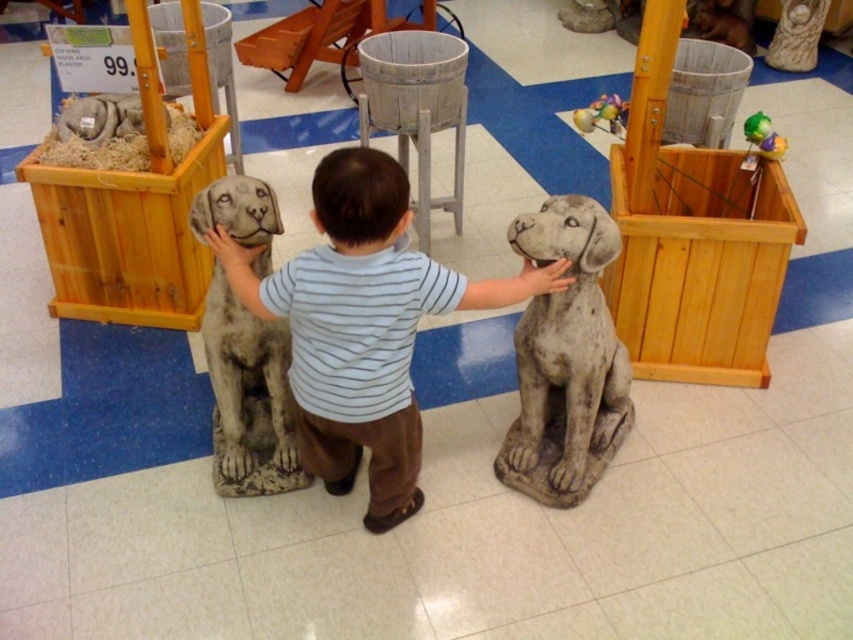
Is point (498, 282) positioned before point (724, 365)?

That is True.

From the picture: Between gray stone dog at center and wooden crate at right, which one appears on the right side from the viewer's perspective?

wooden crate at right is more to the right.

Does point (477, 298) come in front of point (759, 296)?

Yes.

You are a GUI agent. You are given a task and a screenshot of the screen. Output one action in this format:
    pyautogui.click(x=<x>, y=<y>)
    Task: Click on the gray stone dog at center
    Image resolution: width=853 pixels, height=640 pixels.
    Given the screenshot: What is the action you would take?
    pyautogui.click(x=363, y=324)

How far apart are wooden crate at left and shiny plastic ball at upper right?

The distance of wooden crate at left from shiny plastic ball at upper right is 7.80 feet.

Locate an element on the screen. wooden crate at left is located at coordinates (126, 234).

Is speckled stone dog at center further to camera compared to wooden crate at left?

That is False.

Is speckled stone dog at center wider than wooden crate at left?

Incorrect, speckled stone dog at center's width does not surpass wooden crate at left's.

The width and height of the screenshot is (853, 640). Identify the location of speckled stone dog at center. (566, 358).